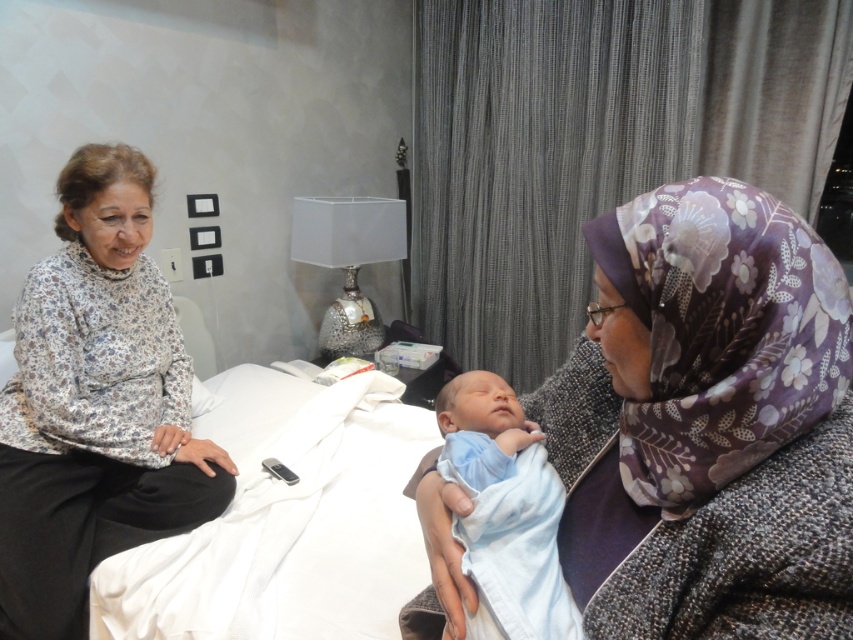
You are a nurse in the hospital room and need to move a medical chart from point (28, 324) to point (635, 227). Will the path between these two points be obstructed by the bed or any other furniture?

Point (635, 227) is in front of point (28, 324), so the path between them is likely unobstructed as the first point is closer to the viewer, implying it is in front spatially. However, without knowing the exact layout of the bed and furniture, this is an assumption based on coordinate positioning.